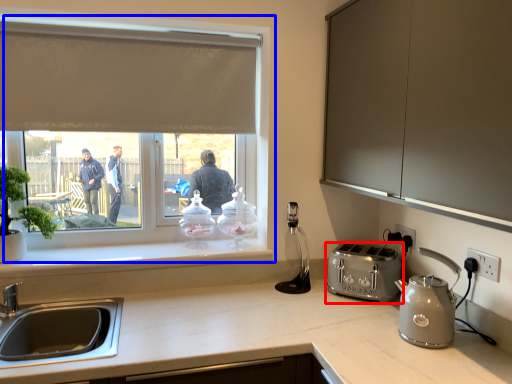
Question: Which of the following is the closest to the observer, toaster (highlighted by a red box) or window (highlighted by a blue box)?

Choices:
 (A) toaster
 (B) window

Answer: (A)